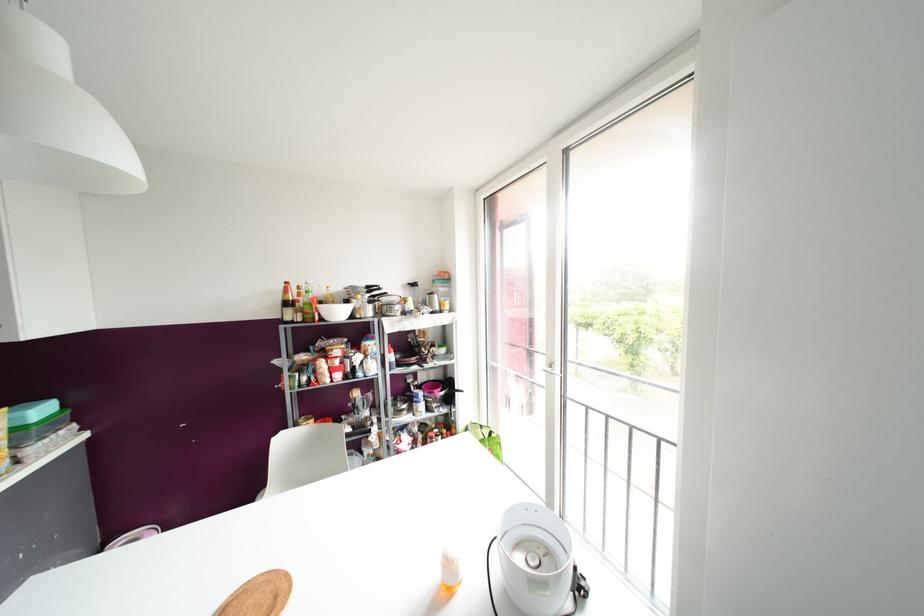
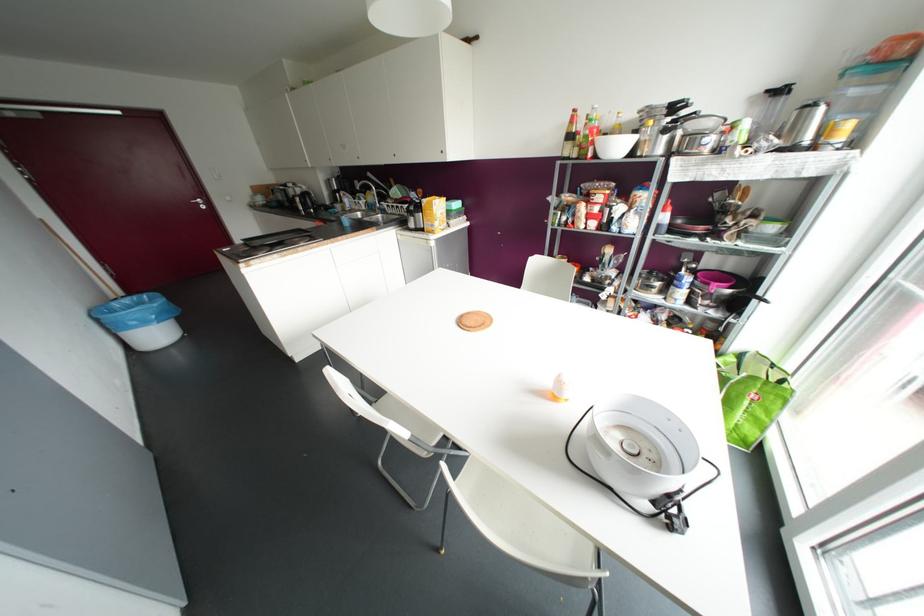
In the second image, find the point that corresponds to [431,394] in the first image.

(703, 286)